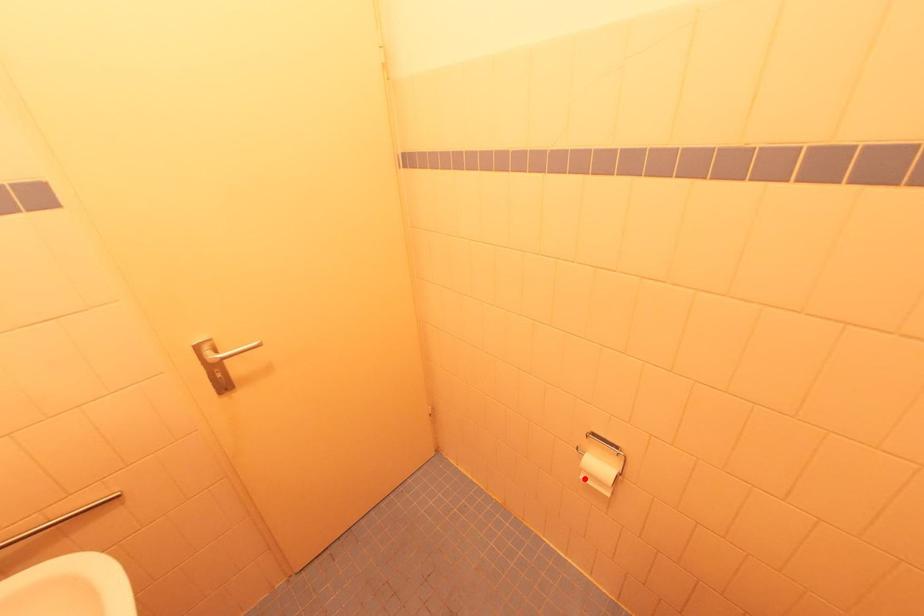
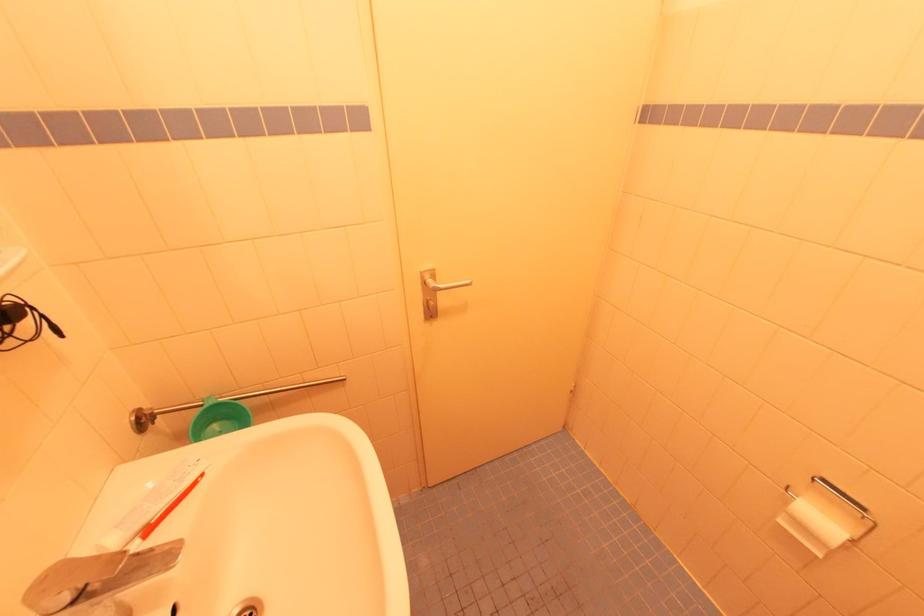
Where in the second image is the point corresponding to the highlighted location from the first image?

(784, 523)